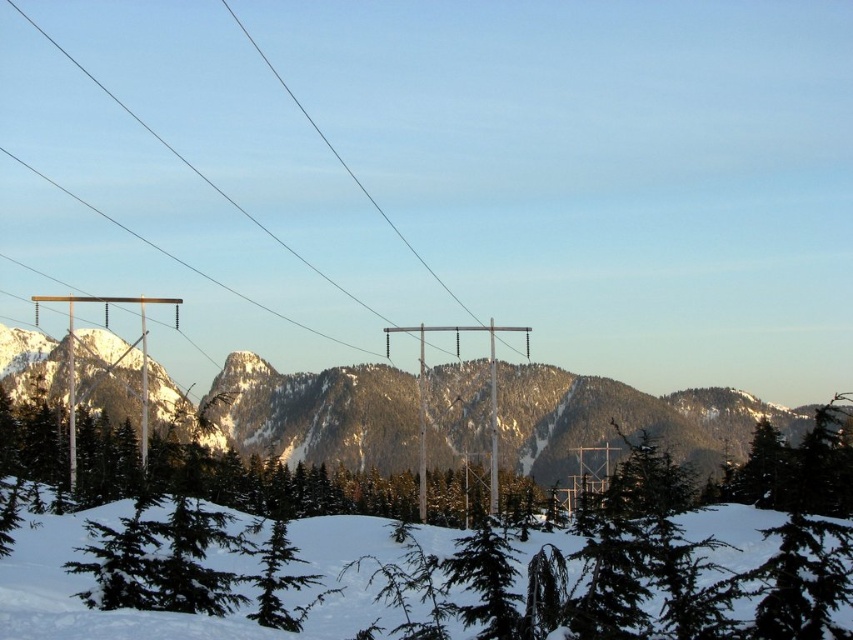
You are an outdoor photographer trying to capture a shot of the snowy rock at center and the green matte tree at center. From your current position, which object is more to the left?

The green matte tree at center is more to the left because the snowy rock at center is positioned on the right side of it.

You are an explorer trying to cross the snowy landscape. You notice a snowy rock at center and a green matte tree at center. Which object is wider? Please choose between the two.

The snowy rock at center is wider than the green matte tree at center according to the description.

From the picture: You are standing at the edge of the snowy landscape looking towards the mountains. There are two points marked on the ground in front of you. The first point is at coordinate (606,385) and the second is at (138,612). Which point is closer to you?

Point (606,385) is closer to you because it is further to the viewer than point (138,612).